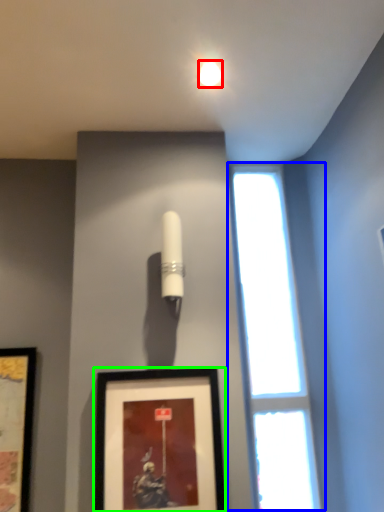
Question: Which object is positioned closest to lighting (highlighted by a red box)? Select from window (highlighted by a blue box) and picture frame (highlighted by a green box).

Choices:
 (A) window
 (B) picture frame

Answer: (A)